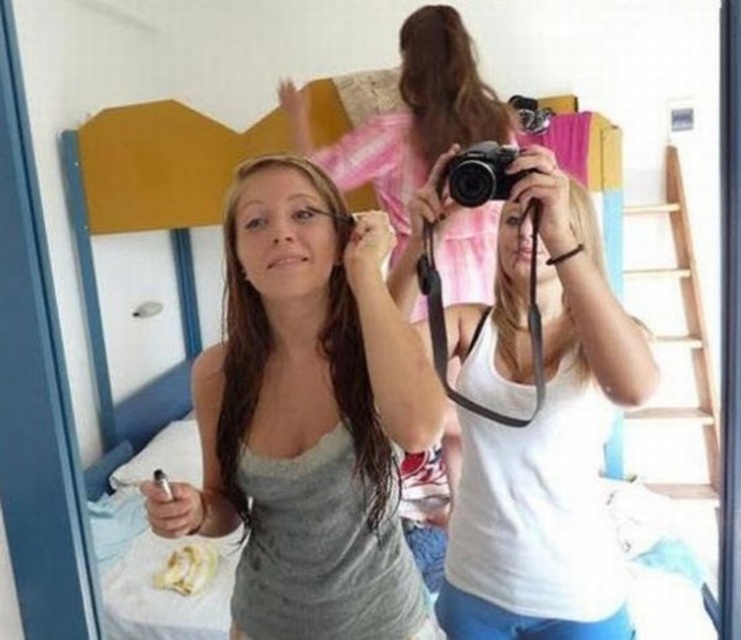
Can you confirm if matte white tank top at center is bigger than black plastic camera at center?

Indeed, matte white tank top at center has a larger size compared to black plastic camera at center.

Which is in front, point (445, 227) or point (456, 196)?

Point (456, 196)

Find the location of a particular element. This screenshot has width=741, height=640. matte white tank top at center is located at coordinates (411, 116).

Who is taller, wooden ladder at right or black plastic camera at center?

With more height is wooden ladder at right.

Is point (631, 241) closer to viewer compared to point (476, 200)?

No, it is not.

Does point (637, 266) lie in front of point (502, 188)?

No, (637, 266) is further to viewer.

The width and height of the screenshot is (741, 640). I want to click on wooden ladder at right, so pyautogui.click(x=671, y=348).

Is point (312, 317) positioned behind point (554, 241)?

Yes, point (312, 317) is farther from viewer.

Is point (186, 509) less distant than point (611, 593)?

That is True.

Is point (262, 547) positioned before point (534, 540)?

Yes, it is.

The width and height of the screenshot is (741, 640). What are the coordinates of `gray matte tank top at center` in the screenshot? It's located at (308, 417).